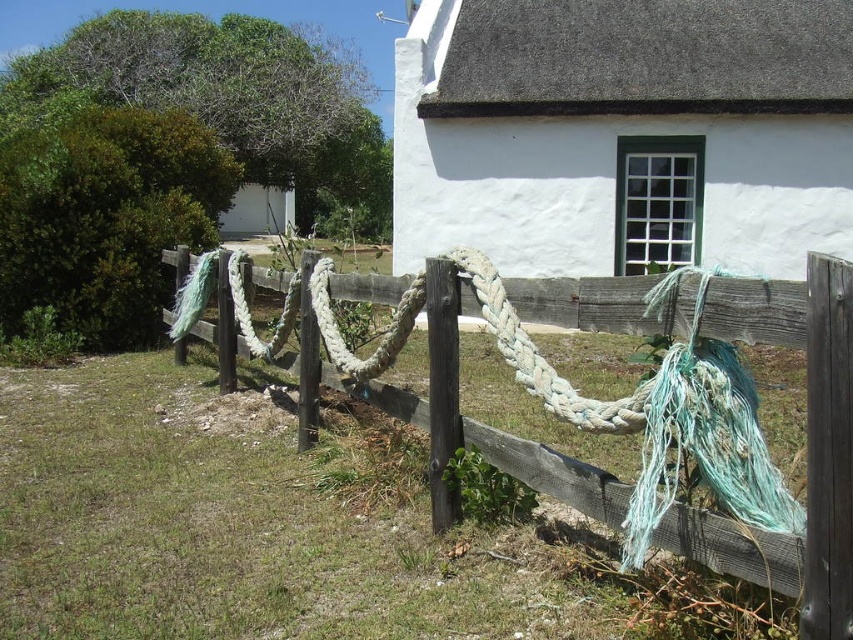
Question: Does white matte fence at center have a smaller size compared to worn wood fence at center?

Choices:
 (A) yes
 (B) no

Answer: (A)

Question: Based on their relative distances, which object is farther from the white matte fence at center?

Choices:
 (A) worn wood fence at center
 (B) worn white rope at center

Answer: (A)

Question: Which object is closer to the camera taking this photo?

Choices:
 (A) white matte fence at center
 (B) worn wood fence at center
 (C) worn white rope at center

Answer: (B)

Question: Is worn wood fence at center positioned behind worn white rope at center?

Choices:
 (A) yes
 (B) no

Answer: (B)

Question: Observing the image, what is the correct spatial positioning of white matte fence at center in reference to worn wood fence at center?

Choices:
 (A) right
 (B) left

Answer: (A)

Question: Which point is closer to the camera?

Choices:
 (A) worn white rope at center
 (B) white matte fence at center

Answer: (A)